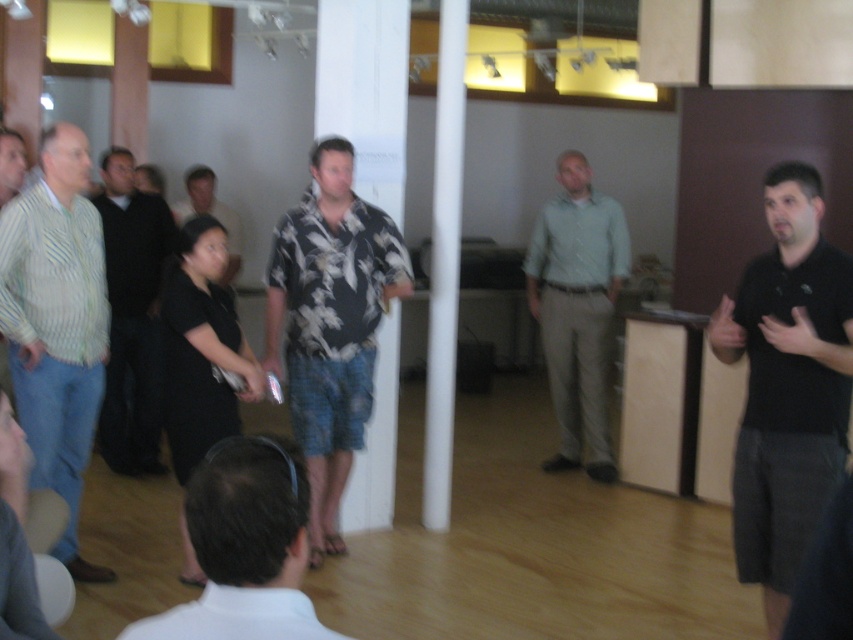
Question: Which of the following is the closest to the observer?

Choices:
 (A) matte green shirt at left
 (B) black floral shirt at center
 (C) black matte shirt at right

Answer: (C)

Question: Which object appears closest to the camera in this image?

Choices:
 (A) striped cotton shirt at left
 (B) floral print shirt at center
 (C) black matte shirt at right
 (D) black shirt at left

Answer: (C)

Question: Is black matte shirt at right below light green shirt at center?

Choices:
 (A) yes
 (B) no

Answer: (A)

Question: Does black shirt at left have a lesser width compared to matte green shirt at left?

Choices:
 (A) yes
 (B) no

Answer: (B)

Question: Where is black shirt at left located in relation to matte green shirt at left in the image?

Choices:
 (A) below
 (B) above

Answer: (A)

Question: Which point is closer to the camera?

Choices:
 (A) (73, 460)
 (B) (335, 182)
 (C) (271, 536)

Answer: (C)